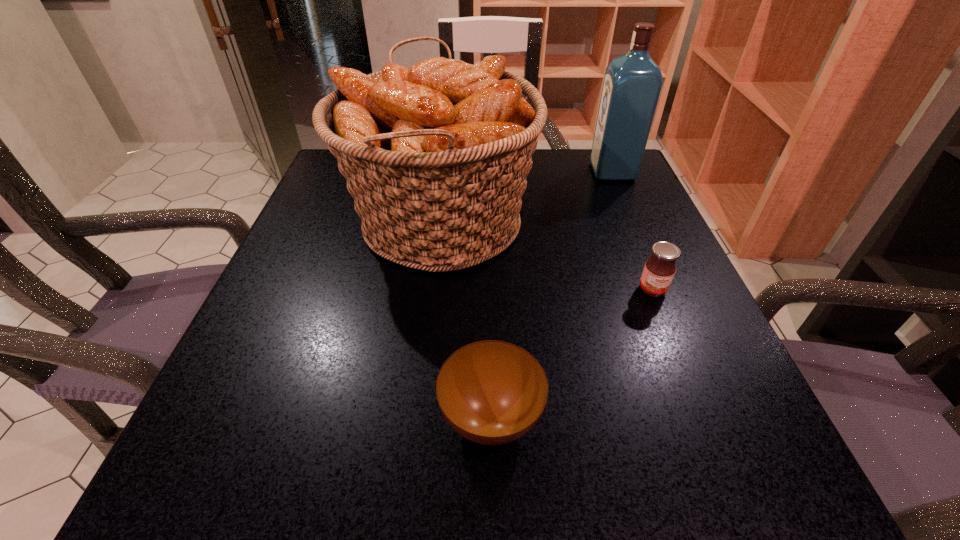
This screenshot has width=960, height=540. I want to click on free space that satisfies the following two spatial constraints: 1. on the front side of the basket; 2. on the left side of the nearest object, so click(x=420, y=417).

What are the coordinates of `free space that satisfies the following two spatial constraints: 1. on the flat label side of the liquor; 2. on the front side of the shortest object` in the screenshot? It's located at (718, 417).